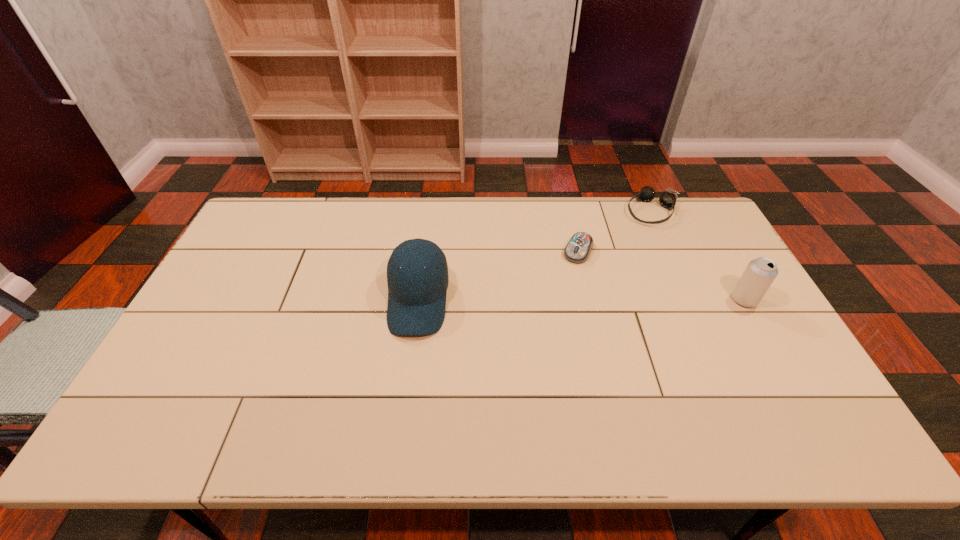
I want to click on free space at the near edge of the desktop, so tap(612, 378).

Where is `vacant space at the left edge`? vacant space at the left edge is located at coordinates (161, 366).

Identify the location of free space at the right edge of the desktop. The image size is (960, 540). (723, 278).

In the image, there is a desktop. Identify the location of vacant space at the far left corner. (276, 212).

In order to click on free spot at the near right corner of the desktop in this screenshot , I will do `click(778, 404)`.

Where is `vacant space in between the third object from right to left and the third tallest object`? This screenshot has height=540, width=960. vacant space in between the third object from right to left and the third tallest object is located at coordinates (615, 231).

Locate an element on the screen. free space between the rightmost object and the farthest object is located at coordinates (698, 255).

I want to click on empty location between the baseball cap and the beer can, so click(x=582, y=300).

Image resolution: width=960 pixels, height=540 pixels. I want to click on vacant area between the beer can and the farthest object, so click(698, 255).

You are a GUI agent. You are given a task and a screenshot of the screen. Output one action in this format:
    pyautogui.click(x=<x>, y=<y>)
    Task: Click on the vacant area that lies between the goggles and the second object from left to right
    This screenshot has width=960, height=540.
    Given the screenshot: What is the action you would take?
    pyautogui.click(x=615, y=231)